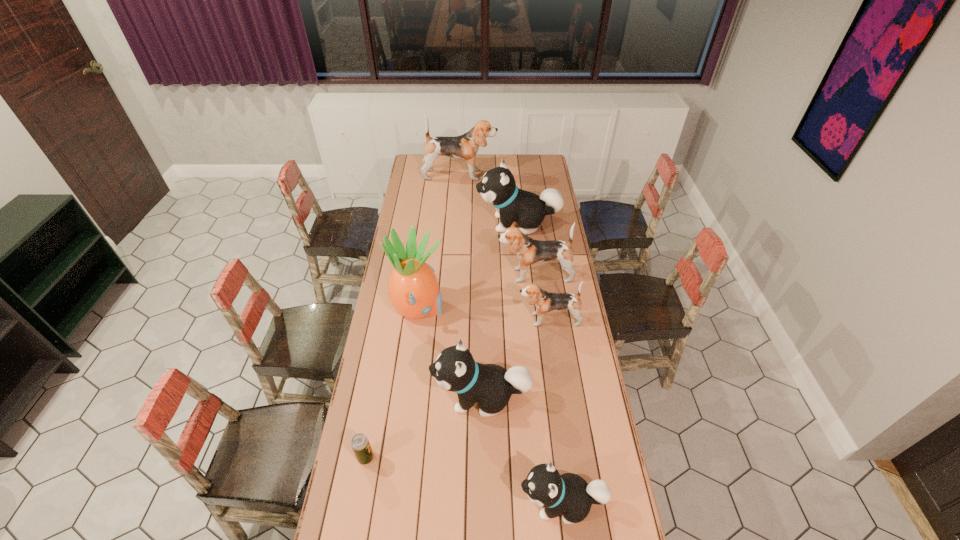
Identify the location of the farthest puppy. This screenshot has height=540, width=960. (464, 147).

The image size is (960, 540). In order to click on the farthest object in this screenshot , I will do `click(464, 147)`.

This screenshot has width=960, height=540. In order to click on pineapple in this screenshot , I will do `click(413, 290)`.

Locate an element on the screen. The image size is (960, 540). the biggest white puppy is located at coordinates (498, 187).

This screenshot has width=960, height=540. What are the coordinates of `the fifth nearest puppy` in the screenshot? It's located at (498, 187).

This screenshot has height=540, width=960. Find the location of `the second biggest brown puppy`. the second biggest brown puppy is located at coordinates (529, 251).

Locate an element on the screen. The width and height of the screenshot is (960, 540). the sixth nearest object is located at coordinates (529, 251).

This screenshot has height=540, width=960. Find the location of `the second nearest puppy`. the second nearest puppy is located at coordinates (455, 370).

This screenshot has height=540, width=960. What are the coordinates of `the sixth farthest object` in the screenshot? It's located at (455, 370).

Identify the location of the nearest brown puppy. The image size is (960, 540). (544, 301).